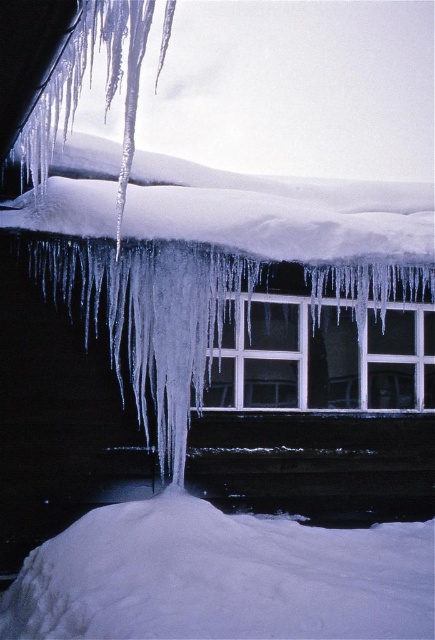
Question: Which point is farther to the camera?

Choices:
 (A) white matte window at center
 (B) white fluffy snow at lower center

Answer: (A)

Question: Does white fluffy snow at lower center have a smaller size compared to white matte window at center?

Choices:
 (A) yes
 (B) no

Answer: (B)

Question: Which point is closer to the camera?

Choices:
 (A) (317, 384)
 (B) (372, 556)

Answer: (B)

Question: Observing the image, what is the correct spatial positioning of white fluffy snow at lower center in reference to white matte window at center?

Choices:
 (A) right
 (B) left

Answer: (B)

Question: Considering the relative positions of white fluffy snow at lower center and white matte window at center in the image provided, where is white fluffy snow at lower center located with respect to white matte window at center?

Choices:
 (A) right
 (B) left

Answer: (B)